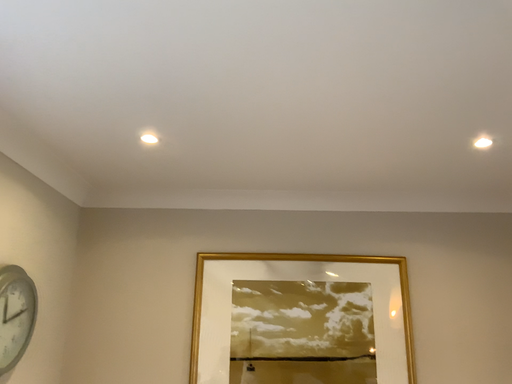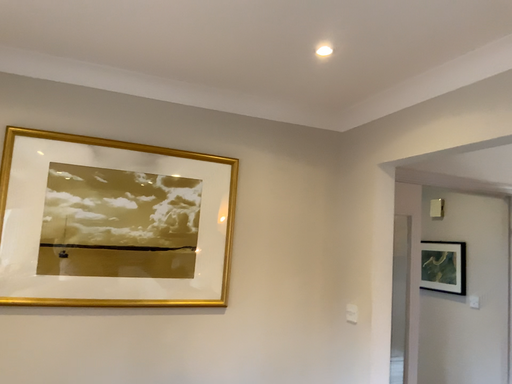
Question: How did the camera likely rotate when shooting the video?

Choices:
 (A) rotated right
 (B) rotated left

Answer: (A)